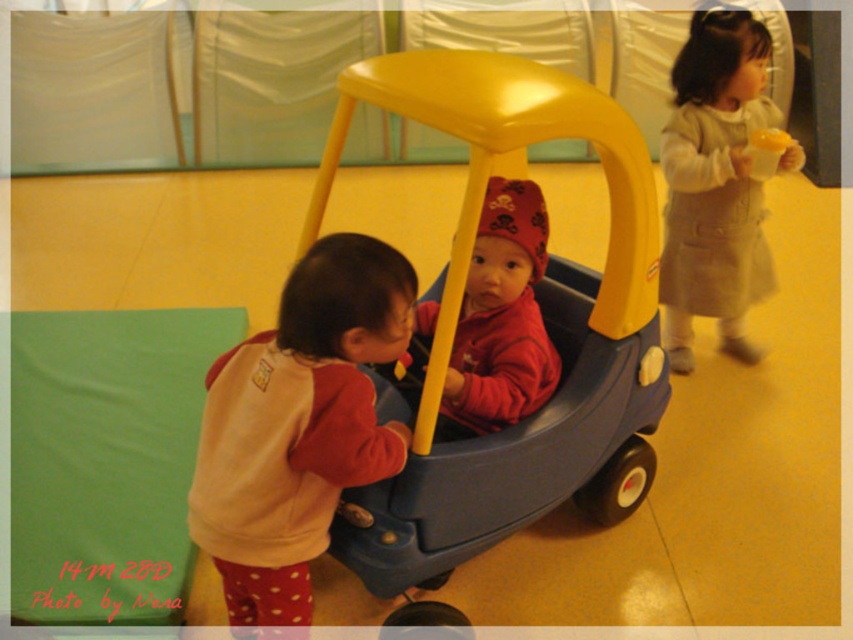
Is beige fleece sweater at left below beige woolen dress at upper right?

Correct, beige fleece sweater at left is located below beige woolen dress at upper right.

Which of these two, beige fleece sweater at left or beige woolen dress at upper right, stands shorter?

beige fleece sweater at left

Does point (265, 413) come in front of point (769, 106)?

Yes.

Identify the location of beige fleece sweater at left. The image size is (853, 640). (299, 426).

Looking at this image, who is positioned more to the left, beige fleece sweater at left or matte red hoodie at center?

beige fleece sweater at left

Can you confirm if beige fleece sweater at left is positioned to the left of matte red hoodie at center?

Yes, beige fleece sweater at left is to the left of matte red hoodie at center.

Between point (368, 404) and point (519, 292), which one is positioned in front?

Point (368, 404) is more forward.

This screenshot has width=853, height=640. Identify the location of beige fleece sweater at left. (299, 426).

Is blue plastic car at center shorter than beige woolen dress at upper right?

No, blue plastic car at center is not shorter than beige woolen dress at upper right.

Who is lower down, blue plastic car at center or beige woolen dress at upper right?

blue plastic car at center is lower down.

Who is more distant from viewer, (434,342) or (735,275)?

The point (735,275) is behind.

What are the coordinates of `blue plastic car at center` in the screenshot? It's located at (540, 305).